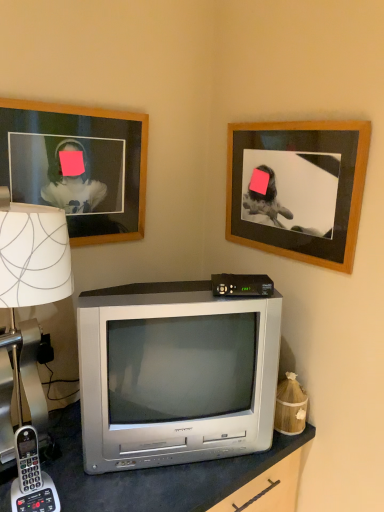
Locate an element on the screen. Image resolution: width=384 pixels, height=512 pixels. blank space situated above wooden frame at upper right, the 1th picture frame positioned from the right (from a real-world perspective) is located at coordinates (308, 112).